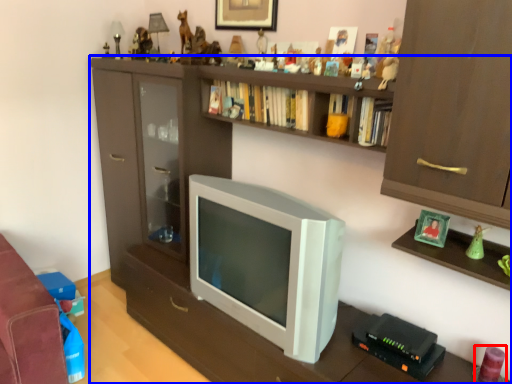
Question: Among these objects, which one is nearest to the camera, toy (highlighted by a red box) or shelf (highlighted by a blue box)?

Choices:
 (A) toy
 (B) shelf

Answer: (B)